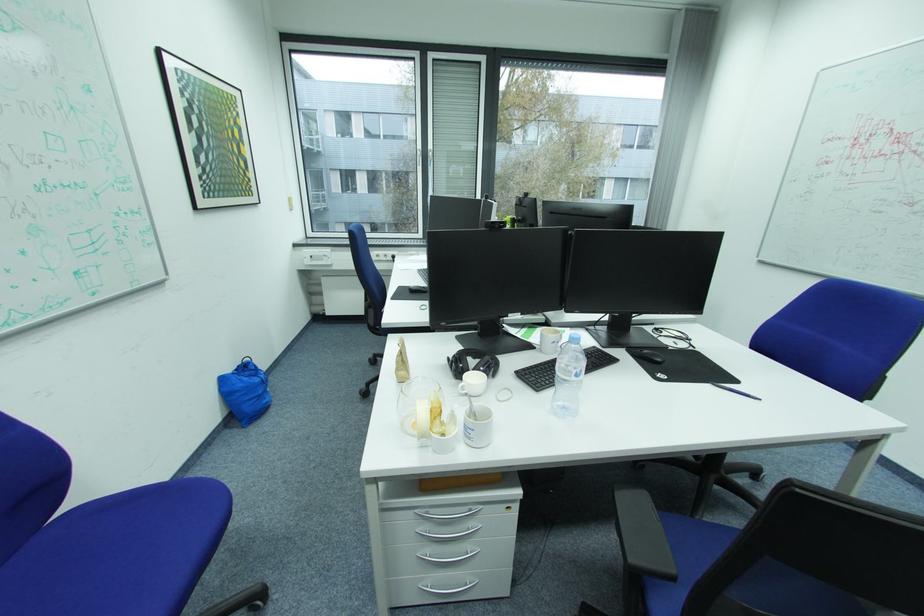
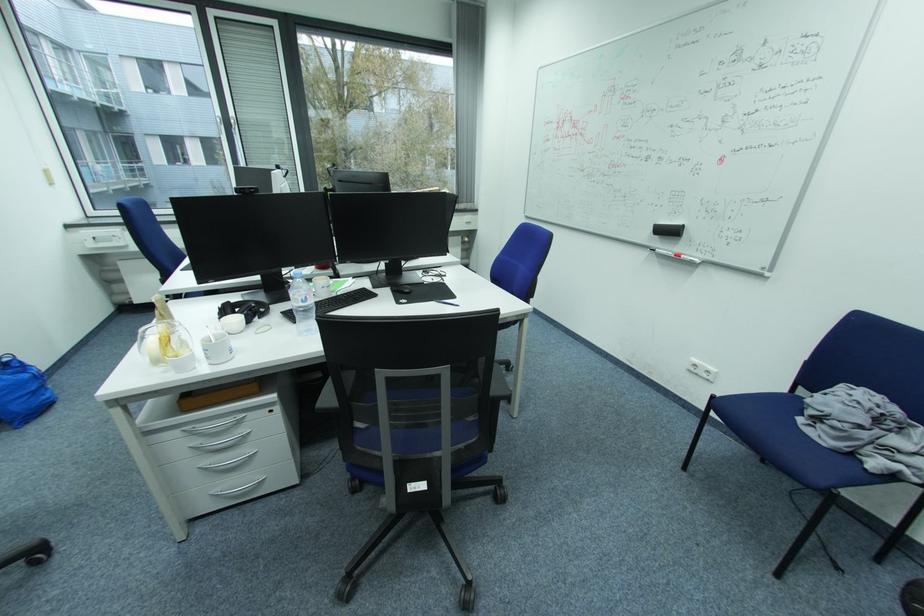
Find the pixel in the second image that matches the point at 495,370 in the first image.

(259, 313)